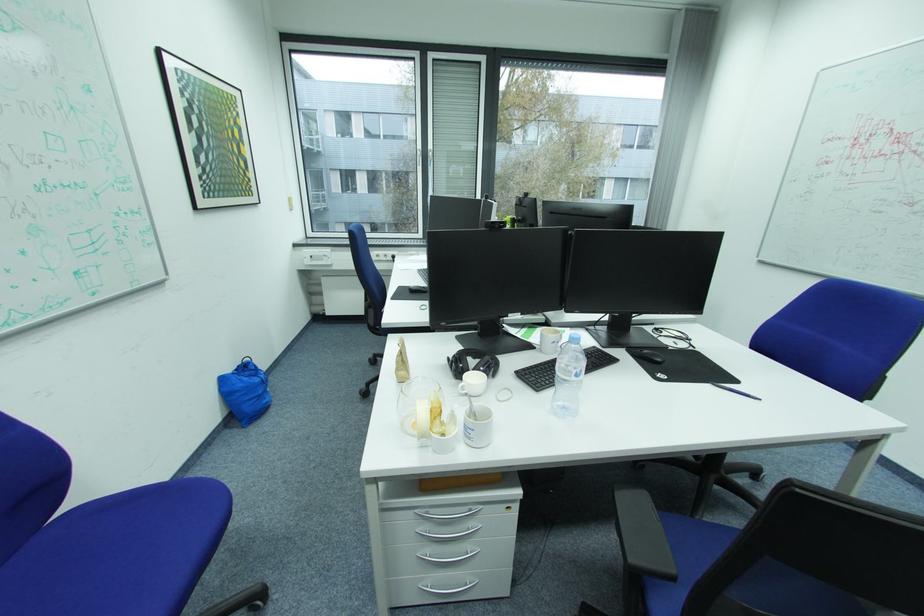
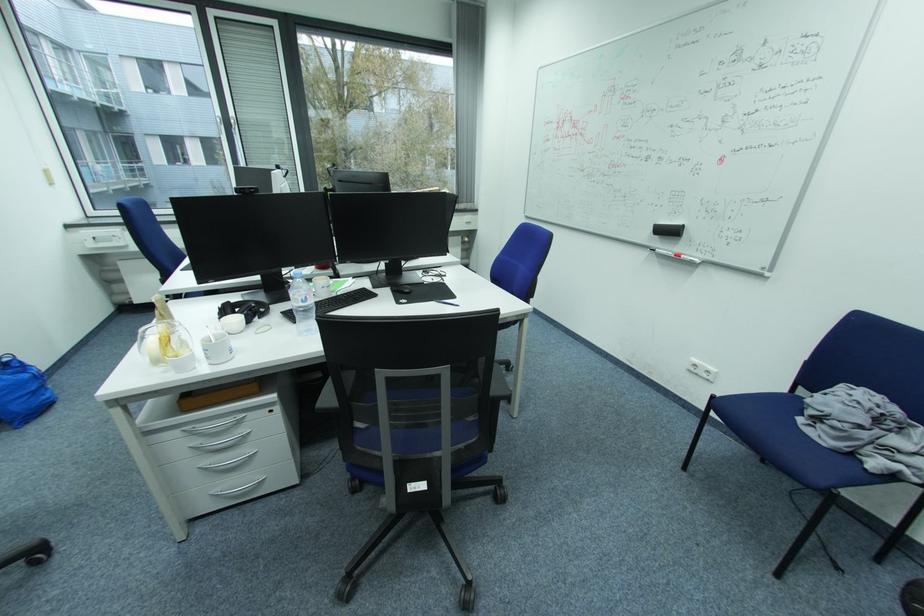
Find the pixel in the second image that matches the point at 495,370 in the first image.

(259, 313)